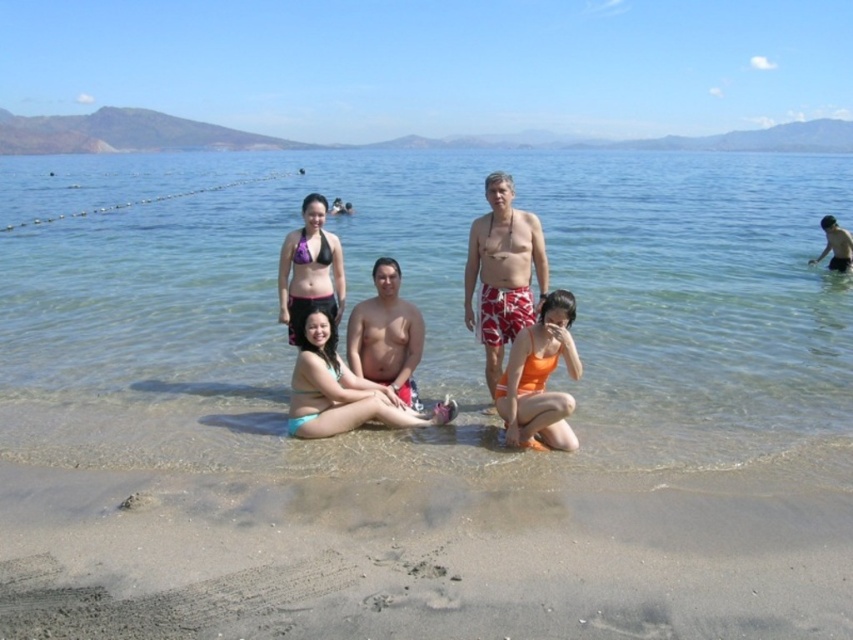
Question: Which point appears closest to the camera in this image?

Choices:
 (A) (527, 388)
 (B) (488, 284)

Answer: (A)

Question: Does matte black bikini top at center have a greater width compared to smooth skin torso at center?

Choices:
 (A) yes
 (B) no

Answer: (A)

Question: Among these points, which one is nearest to the camera?

Choices:
 (A) click(393, 259)
 (B) click(453, 369)
 (C) click(296, 300)
 (D) click(534, 224)

Answer: (D)

Question: Which of the following is the closest to the observer?

Choices:
 (A) (508, 269)
 (B) (549, 156)

Answer: (A)

Question: From the image, what is the correct spatial relationship of smooth skin torso at center in relation to purple matte bikini top at center?

Choices:
 (A) below
 (B) above

Answer: (A)

Question: Can you confirm if sandy beach at lower center is positioned above red and white patterned shorts at center?

Choices:
 (A) no
 (B) yes

Answer: (A)